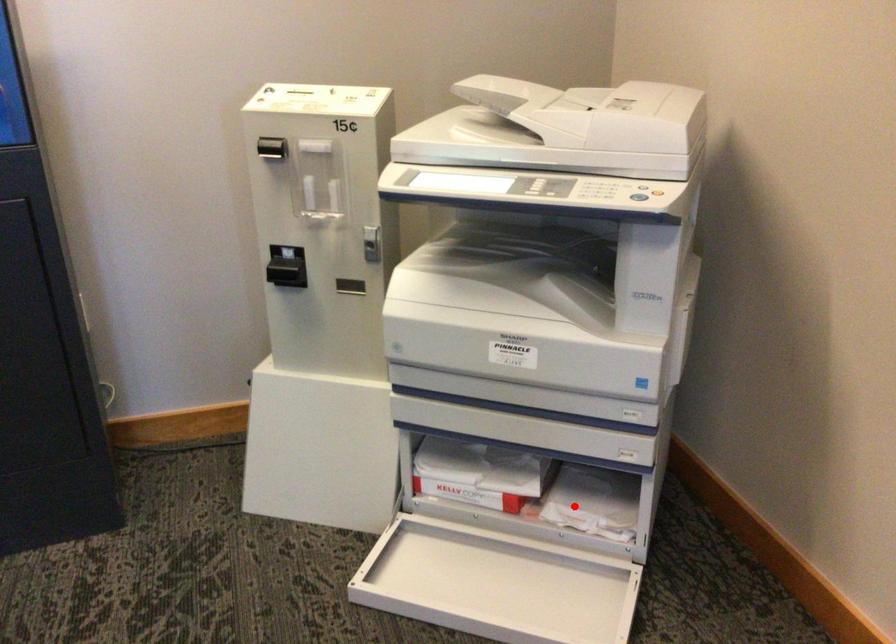
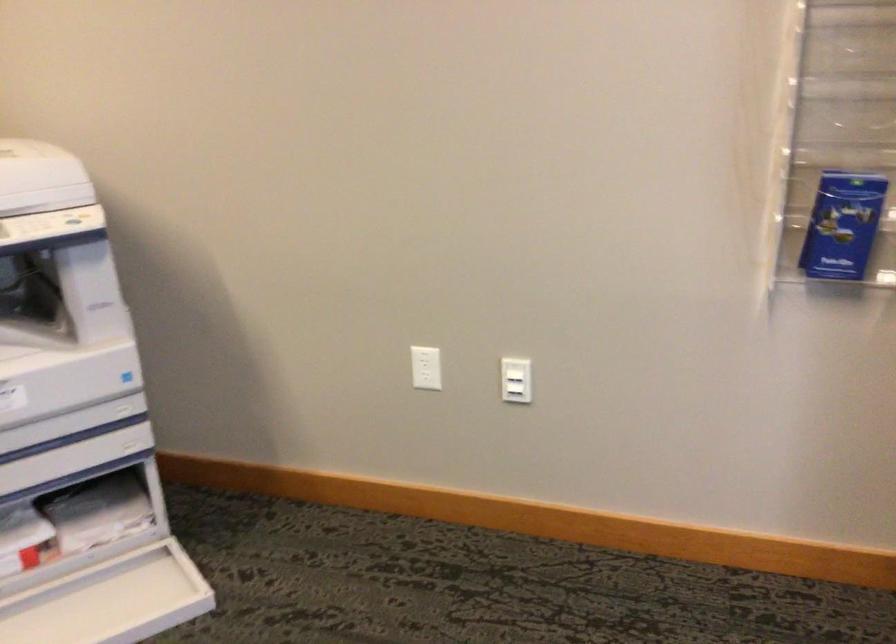
Find the pixel in the second image that matches the highlighted location in the first image.

(91, 523)